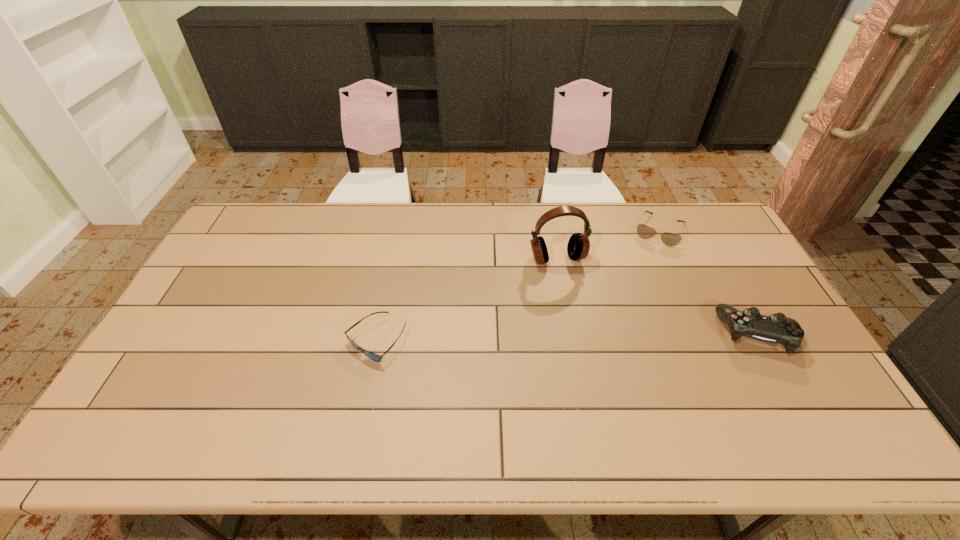
The height and width of the screenshot is (540, 960). What are the coordinates of `free space at the near edge of the desktop` in the screenshot? It's located at pos(418,401).

Locate an element on the screen. free space at the right edge of the desktop is located at coordinates (769, 343).

I want to click on vacant space at the far left corner, so click(269, 240).

The image size is (960, 540). In the image, there is a desktop. Find the location of `vacant space at the near left corner`. vacant space at the near left corner is located at coordinates 127,409.

At what (x,y) coordinates should I click in order to perform the action: click on vacant space at the far right corner of the desktop. Please return your answer as a coordinate pair (x, y). This screenshot has width=960, height=540. Looking at the image, I should click on (702, 206).

Where is `free space that is in between the second object from left to right and the leftmost object`? This screenshot has height=540, width=960. free space that is in between the second object from left to right and the leftmost object is located at coordinates (467, 300).

Where is `free space between the third shortest object and the second farthest object`? The width and height of the screenshot is (960, 540). free space between the third shortest object and the second farthest object is located at coordinates (657, 296).

The image size is (960, 540). I want to click on unoccupied area between the second tallest object and the left sunglasses, so click(566, 337).

Locate an element on the screen. The image size is (960, 540). vacant region between the second farthest object and the farther sunglasses is located at coordinates (608, 245).

What are the coordinates of `free area in between the second farthest object and the nearer sunglasses` in the screenshot? It's located at (467, 300).